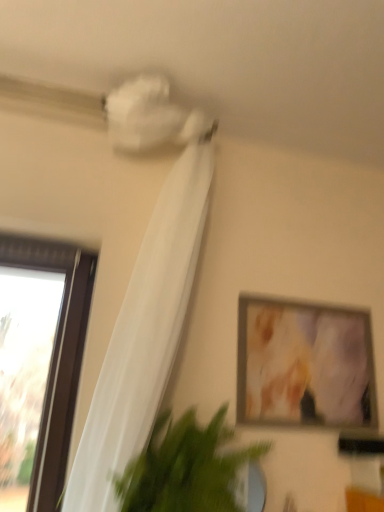
Question: Does matte wooden picture frame at upper right come behind white sheer curtain at upper left?

Choices:
 (A) yes
 (B) no

Answer: (A)

Question: Does matte wooden picture frame at upper right have a lesser width compared to white sheer curtain at upper left?

Choices:
 (A) yes
 (B) no

Answer: (A)

Question: Does matte wooden picture frame at upper right appear on the right side of white sheer curtain at upper left?

Choices:
 (A) yes
 (B) no

Answer: (A)

Question: Does matte wooden picture frame at upper right have a greater width compared to white sheer curtain at upper left?

Choices:
 (A) no
 (B) yes

Answer: (A)

Question: From the image's perspective, is matte wooden picture frame at upper right on white sheer curtain at upper left?

Choices:
 (A) no
 (B) yes

Answer: (A)

Question: Is matte wooden picture frame at upper right bigger than white sheer curtain at upper left?

Choices:
 (A) no
 (B) yes

Answer: (A)

Question: Is white sheer curtain at upper left to the right of green leafy plant at lower left from the viewer's perspective?

Choices:
 (A) no
 (B) yes

Answer: (A)

Question: Is there a large distance between white sheer curtain at upper left and green leafy plant at lower left?

Choices:
 (A) no
 (B) yes

Answer: (A)

Question: Is white sheer curtain at upper left taller than green leafy plant at lower left?

Choices:
 (A) no
 (B) yes

Answer: (B)

Question: Considering the relative positions of white sheer curtain at upper left and green leafy plant at lower left in the image provided, is white sheer curtain at upper left in front of green leafy plant at lower left?

Choices:
 (A) yes
 (B) no

Answer: (A)

Question: From a real-world perspective, is white sheer curtain at upper left physically below green leafy plant at lower left?

Choices:
 (A) yes
 (B) no

Answer: (B)

Question: Does white sheer curtain at upper left have a smaller size compared to green leafy plant at lower left?

Choices:
 (A) yes
 (B) no

Answer: (B)

Question: From the image's perspective, is matte wooden picture frame at upper right above green leafy plant at lower left?

Choices:
 (A) yes
 (B) no

Answer: (A)